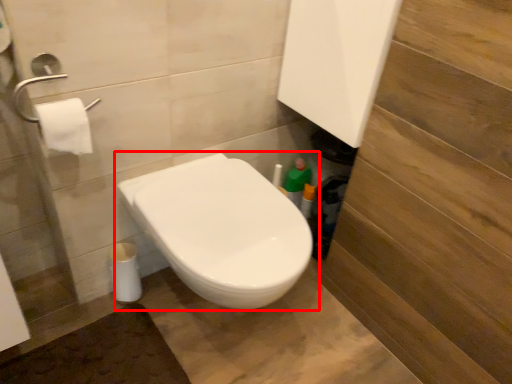
Question: From the image's perspective, where is toilet (annotated by the red box) located in relation to toilet paper in the image?

Choices:
 (A) above
 (B) below

Answer: (B)